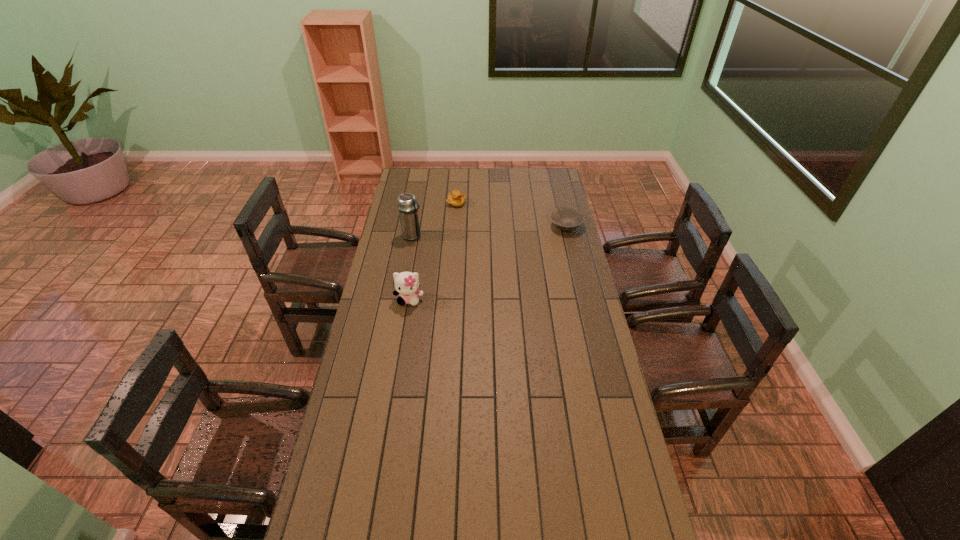
The image size is (960, 540). I want to click on vacant space on the desktop that is between the kitten and the shortest object and is positioned at the beak of the second object from right to left, so click(501, 256).

At what (x,y) coordinates should I click in order to perform the action: click on free space on the desktop that is between the kitten and the bowl and is positioned with a handle on the side of the tallest object. Please return your answer as a coordinate pair (x, y). Looking at the image, I should click on (489, 262).